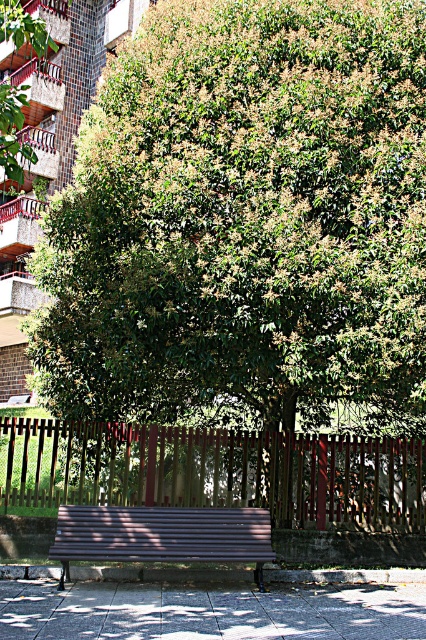
You are standing in the urban setting and want to walk from point A to point B. Point A is at point (330, 486) and point B is at point (135, 515). Which point is closer to you when you start walking?

Point A at point (330, 486) is closer to you than point B at point (135, 515) because it is further to the viewer.

You are planning to place a new flower pot between the brown wooden fence at center and the brown wooden bench at center. Considering their sizes, which object should the flower pot be closer to?

The flower pot should be closer to the brown wooden bench at center because the brown wooden fence at center is larger in size, so there might be more space near the smaller bench to accommodate the pot without overcrowding the area.

You are standing in the urban setting and want to take a photo of the large tree with dense foliage. If you move forward 10 feet towards the point at coordinates point (201, 451), will you be closer to the tree?

The distance of point (201, 451) from viewer is 26.54 feet. Moving forward 10 feet towards this point would bring you to 16.54 feet away from the tree, so yes, you would be closer to the tree.